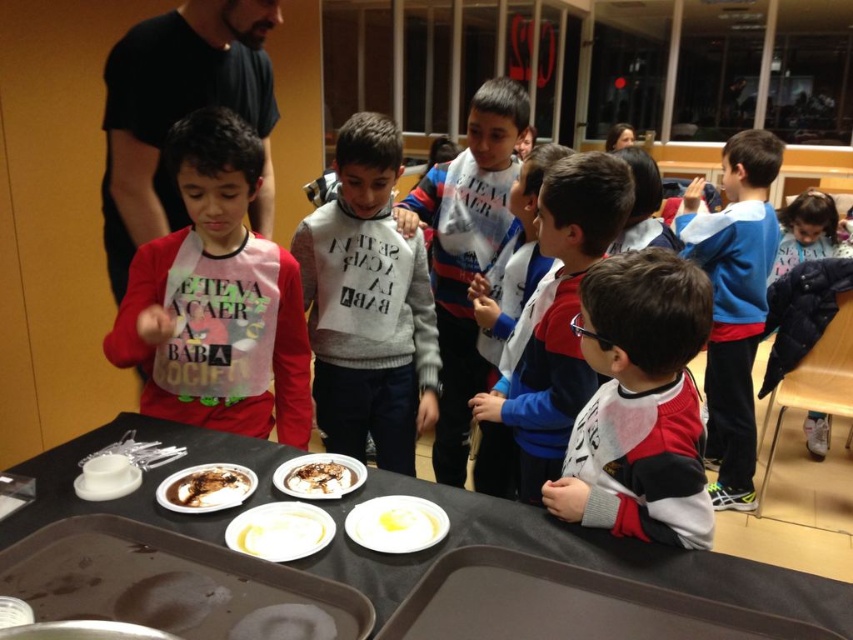
Between brown plastic tray at lower center and chocolate glazed donut at lower left, which one has less height?

→ With less height is chocolate glazed donut at lower left.

Is point (457, 576) farther from camera compared to point (212, 506)?

No, it is in front of (212, 506).

What are the coordinates of `brown plastic tray at lower center` in the screenshot? It's located at (566, 605).

Image resolution: width=853 pixels, height=640 pixels. I want to click on matte red sweater at left, so click(x=216, y=298).

Between point (306, 417) and point (814, 582), which one is positioned in front?

Positioned in front is point (814, 582).

Where is `matte red sweater at left`? The width and height of the screenshot is (853, 640). matte red sweater at left is located at coordinates (216, 298).

Is black plastic tray at center to the right of white cotton sweater at center from the viewer's perspective?

Incorrect, black plastic tray at center is not on the right side of white cotton sweater at center.

Who is more forward, [801,573] or [457,365]?

Point [801,573] is in front.

Between point (848, 625) and point (474, 180), which one is positioned in front?

Point (848, 625)

You are a GUI agent. You are given a task and a screenshot of the screen. Output one action in this format:
    pyautogui.click(x=<x>, y=<y>)
    Task: Click on the black plastic tray at center
    The height and width of the screenshot is (640, 853).
    Given the screenshot: What is the action you would take?
    pyautogui.click(x=570, y=557)